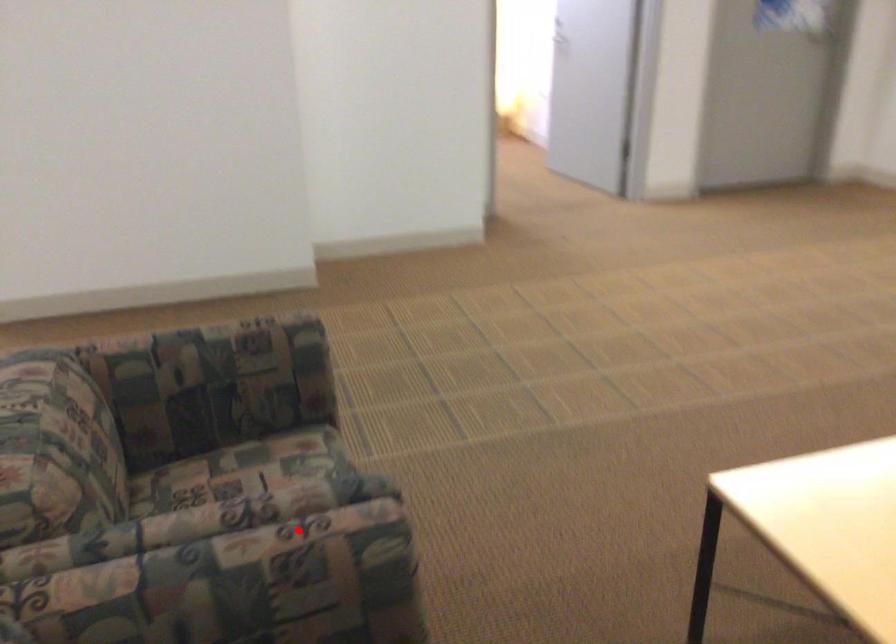
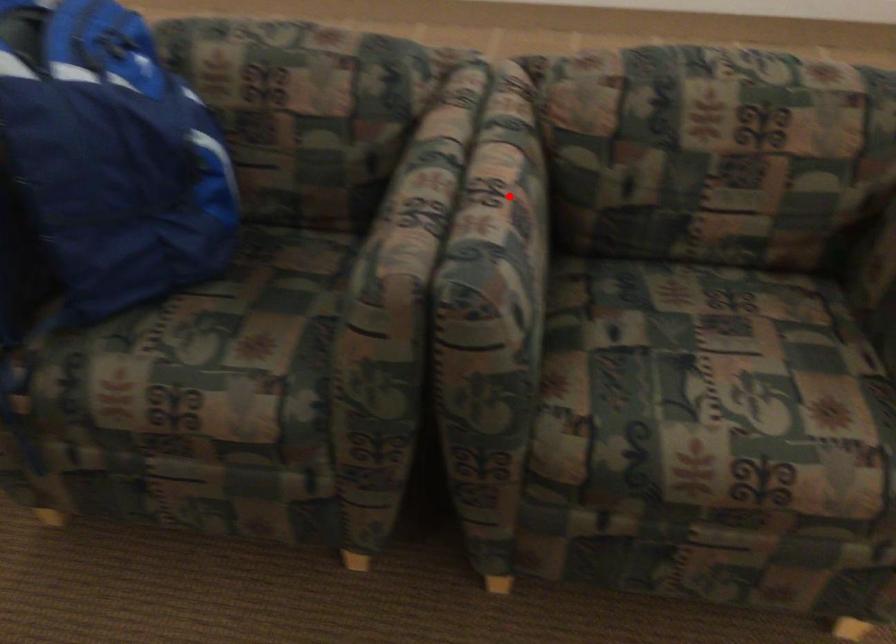
I am providing you with two images of the same scene from different viewpoints. A red point is marked on the first image and another point is marked on the second image. Is the marked point in image1 the same physical position as the marked point in image2?

No